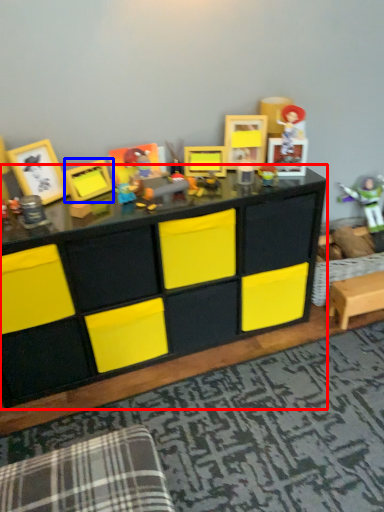
Question: Which object appears closest to the camera in this image, table (highlighted by a red box) or picture frame (highlighted by a blue box)?

Choices:
 (A) table
 (B) picture frame

Answer: (A)